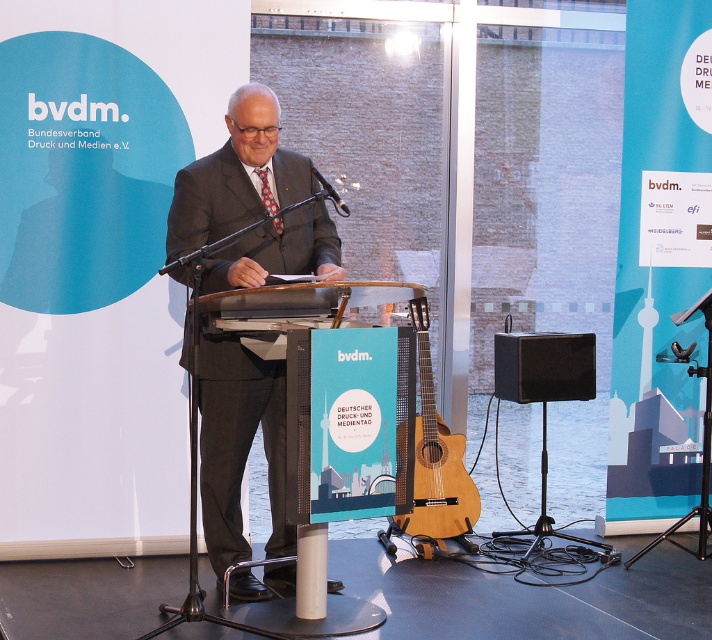
Question: Is matte black suit at center below red silk tie at center?

Choices:
 (A) yes
 (B) no

Answer: (A)

Question: Which object is closer to the camera taking this photo?

Choices:
 (A) black matte speaker at right
 (B) natural wood acoustic guitar at center
 (C) metallic shiny microphone at center
 (D) red silk tie at center

Answer: (C)

Question: Which point is closer to the camera?

Choices:
 (A) (450, 435)
 (B) (219, 573)
 (C) (261, 186)
 (D) (330, 186)

Answer: (D)

Question: Is red silk tie at center wider than metallic shiny microphone at center?

Choices:
 (A) no
 (B) yes

Answer: (A)

Question: Is matte black suit at center positioned before metallic shiny microphone at center?

Choices:
 (A) yes
 (B) no

Answer: (B)

Question: Which point is farther to the camera?

Choices:
 (A) red silk tie at center
 (B) matte black suit at center
 (C) black matte speaker at right
 (D) natural wood acoustic guitar at center

Answer: (C)